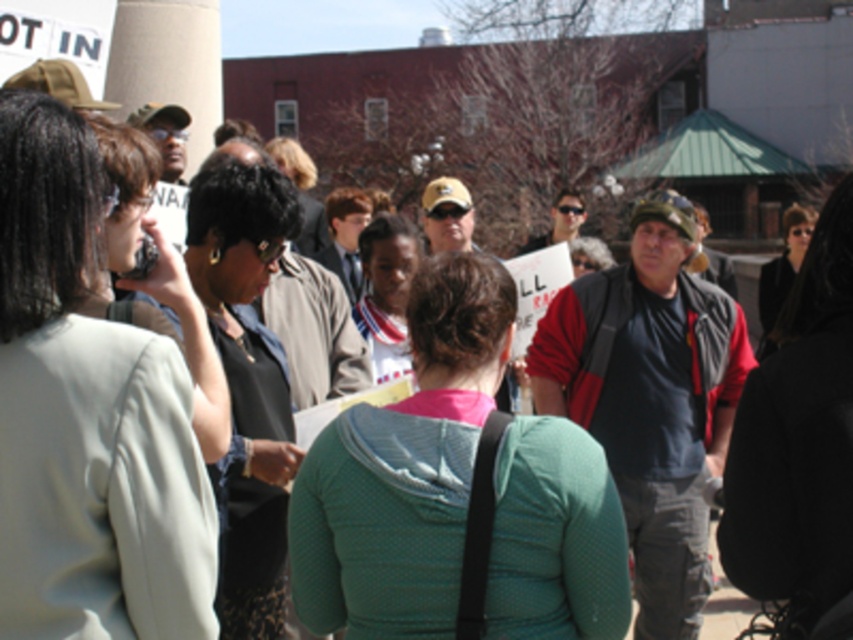
You are standing in the crowd at the event and want to take a photo of both the person at point (438, 460) and the person at point (376, 285). Which person will appear larger in the photo?

The person at point (438, 460) will appear larger in the photo because they are closer to the camera than the person at point (376, 285).

You are a photographer trying to capture a candid shot of the matte fabric jacket at center and the black fabric jacket at center. Which jacket should you focus on first if you want to photograph them from left to right order?

The matte fabric jacket at center should be focused on first because the black fabric jacket at center is positioned to its right side, so moving from left to right, the matte jacket comes first.